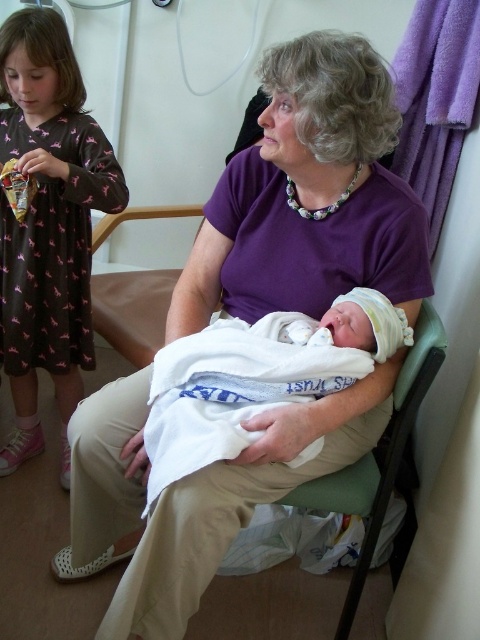
Does brown cotton dress at left appear on the left side of white soft blanket at center?

Correct, you'll find brown cotton dress at left to the left of white soft blanket at center.

Does brown cotton dress at left lie in front of white soft blanket at center?

No, brown cotton dress at left is behind white soft blanket at center.

Is point (72, 131) behind point (296, 445)?

Yes, it is.

Where is `brown cotton dress at left`? brown cotton dress at left is located at coordinates (48, 224).